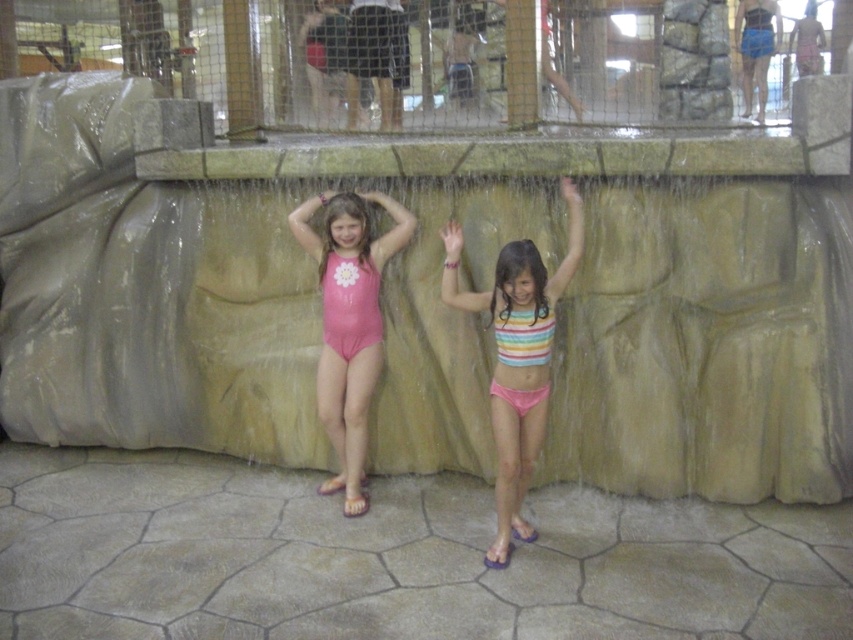
Question: Is rainbow striped bikini top at center positioned at the back of pink rubber swimsuit at center?

Choices:
 (A) yes
 (B) no

Answer: (B)

Question: Among these points, which one is nearest to the camera?

Choices:
 (A) (500, 465)
 (B) (328, 205)

Answer: (A)

Question: Among these points, which one is nearest to the camera?

Choices:
 (A) (344, 241)
 (B) (508, 355)

Answer: (B)

Question: Does rainbow striped bikini top at center have a lesser width compared to pink rubber swimsuit at center?

Choices:
 (A) yes
 (B) no

Answer: (B)

Question: Is rainbow striped bikini top at center below pink rubber swimsuit at center?

Choices:
 (A) yes
 (B) no

Answer: (A)